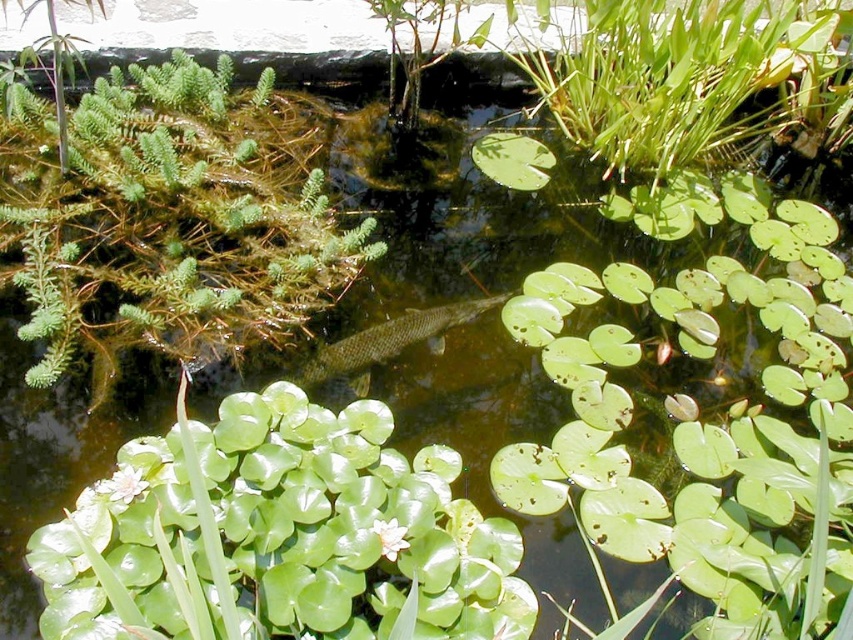
You are a frog sitting at the point with coordinates point (149,582). You want to jump to the point with coordinates point (200,205). Will you jump towards the background or the foreground of the image?

Point (149,582) is in front of point (200,205), so jumping from point (149,582) to point (200,205) would mean moving towards the background of the image.

You are a frog sitting on the green fuzzy plant at upper left and want to jump to the green scaly fish at center. Which direction should you jump to reach it?

The green fuzzy plant at upper left is to the left of the green scaly fish at center, so you should jump to the right to reach it.

You are a photographer trying to capture the aquatic scene. You notice two points in the image, one at point (57,632) and the other at point (453,321). Which point should you focus on to ensure it appears sharper in your photo?

You should focus on point (57,632) because it is closer to the camera and will appear sharper in the photo compared to point (453,321) which is further away.